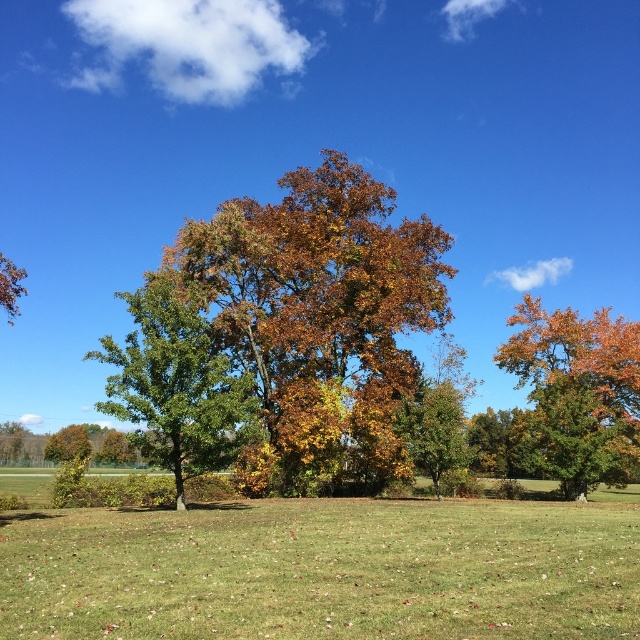
Does point (145, 374) come in front of point (49, 460)?

Yes.

Is green leafy tree at left smaller than green matte tree at lower left?

Correct, green leafy tree at left occupies less space than green matte tree at lower left.

Which is in front, point (196, 467) or point (58, 451)?

Point (196, 467)

In order to click on green leafy tree at left in this screenshot , I will do `click(177, 385)`.

Is point (468, 500) positioned in front of point (61, 451)?

Yes, it is in front of point (61, 451).

Does green grass at center appear on the left side of green matte tree at lower left?

In fact, green grass at center is to the right of green matte tree at lower left.

In order to click on green grass at center in this screenshot , I will do `click(326, 570)`.

Locate an element on the screen. The height and width of the screenshot is (640, 640). green grass at center is located at coordinates (326, 570).

Does green grass at center have a greater width compared to green leafy tree at left?

Yes, green grass at center is wider than green leafy tree at left.

From the picture: Is green grass at center to the left of green leafy tree at left from the viewer's perspective?

Incorrect, green grass at center is not on the left side of green leafy tree at left.

Identify the location of green grass at center. click(x=326, y=570).

Where is `green grass at center`? green grass at center is located at coordinates (326, 570).